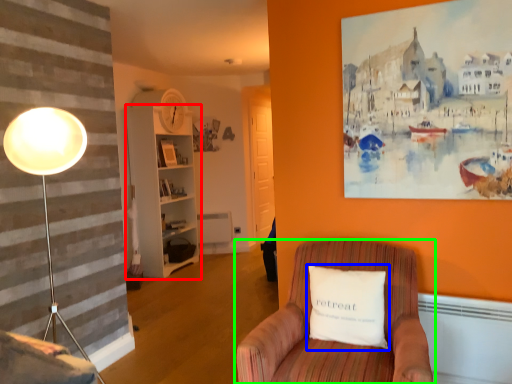
Question: Based on their relative distances, which object is farther from bookshelf (highlighted by a red box)? Choose from pillow (highlighted by a blue box) and chair (highlighted by a green box).

Choices:
 (A) pillow
 (B) chair

Answer: (A)